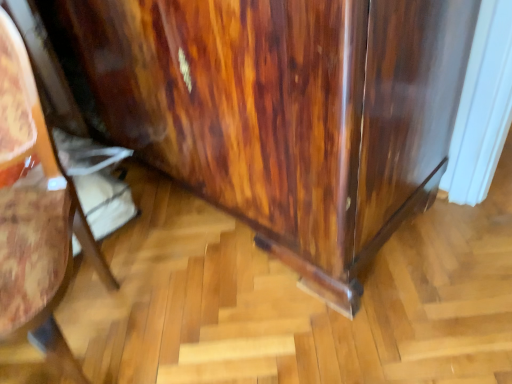
Find the location of a particular element. This screenshot has width=512, height=384. glossy wood cabinet at lower right is located at coordinates (35, 214).

This screenshot has width=512, height=384. Describe the element at coordinates (35, 214) in the screenshot. I see `glossy wood cabinet at lower right` at that location.

In order to face glossy wood cabinet at lower right, should I rotate leftwards or rightwards?

You should rotate left by 33.629 degrees.

In order to face glossy wood dresser at lower right, should I rotate leftwards or rightwards?

It's best to rotate left around 8.613 degrees.

This screenshot has width=512, height=384. What are the coordinates of `glossy wood dresser at lower right` in the screenshot? It's located at (281, 111).

What do you see at coordinates (281, 111) in the screenshot?
I see `glossy wood dresser at lower right` at bounding box center [281, 111].

What are the coordinates of `glossy wood cabinet at lower right` in the screenshot? It's located at (35, 214).

In the scene shown: Considering the relative positions of glossy wood dresser at lower right and glossy wood cabinet at lower right in the image provided, is glossy wood dresser at lower right to the right of glossy wood cabinet at lower right from the viewer's perspective?

Indeed, glossy wood dresser at lower right is positioned on the right side of glossy wood cabinet at lower right.

Is glossy wood dresser at lower right positioned behind glossy wood cabinet at lower right?

Yes, glossy wood dresser at lower right is further from the camera.

Consider the image. Which is nearer, (304, 158) or (52, 268)?

The point (52, 268) is in front.

Based on the photo, from the image's perspective, is glossy wood dresser at lower right above glossy wood cabinet at lower right?

Yes, from the image's perspective, glossy wood dresser at lower right is on top of glossy wood cabinet at lower right.

From a real-world perspective, which object stands above the other?

glossy wood dresser at lower right is physically above.

Considering the sizes of glossy wood dresser at lower right and glossy wood cabinet at lower right in the image, is glossy wood dresser at lower right wider or thinner than glossy wood cabinet at lower right?

Clearly, glossy wood dresser at lower right has more width compared to glossy wood cabinet at lower right.

Considering the sizes of glossy wood dresser at lower right and glossy wood cabinet at lower right in the image, is glossy wood dresser at lower right taller or shorter than glossy wood cabinet at lower right?

Clearly, glossy wood dresser at lower right is taller compared to glossy wood cabinet at lower right.

Is glossy wood dresser at lower right bigger or smaller than glossy wood cabinet at lower right?

In the image, glossy wood dresser at lower right appears to be larger than glossy wood cabinet at lower right.

Is glossy wood dresser at lower right outside of glossy wood cabinet at lower right?

Indeed, glossy wood dresser at lower right is completely outside glossy wood cabinet at lower right.

Is glossy wood dresser at lower right directly adjacent to glossy wood cabinet at lower right?

There is a gap between glossy wood dresser at lower right and glossy wood cabinet at lower right.

Is glossy wood dresser at lower right aimed at glossy wood cabinet at lower right?

Yes, glossy wood dresser at lower right is turned towards glossy wood cabinet at lower right.

This screenshot has height=384, width=512. What are the coordinates of `dresser that is above the glossy wood cabinet at lower right (from a real-world perspective)` in the screenshot? It's located at [x=281, y=111].

Is glossy wood cabinet at lower right to the right of glossy wood dresser at lower right from the viewer's perspective?

Incorrect, glossy wood cabinet at lower right is not on the right side of glossy wood dresser at lower right.

Which object is further away from the camera, glossy wood cabinet at lower right or glossy wood dresser at lower right?

glossy wood dresser at lower right is more distant.

Which point is more forward, (58, 183) or (231, 160)?

Point (58, 183)

From the image's perspective, relative to glossy wood dresser at lower right, is glossy wood cabinet at lower right above or below?

Clearly, from the image's perspective, glossy wood cabinet at lower right is below glossy wood dresser at lower right.

From a real-world perspective, is glossy wood cabinet at lower right positioned over glossy wood dresser at lower right based on gravity?

No.

Considering the relative sizes of glossy wood cabinet at lower right and glossy wood dresser at lower right in the image provided, is glossy wood cabinet at lower right thinner than glossy wood dresser at lower right?

Yes.

Can you confirm if glossy wood cabinet at lower right is taller than glossy wood dresser at lower right?

No, glossy wood cabinet at lower right is not taller than glossy wood dresser at lower right.

Looking at the image, does glossy wood cabinet at lower right seem bigger or smaller compared to glossy wood dresser at lower right?

glossy wood cabinet at lower right is smaller than glossy wood dresser at lower right.

Would you say glossy wood cabinet at lower right contains glossy wood dresser at lower right?

Definitely not — glossy wood dresser at lower right is not inside glossy wood cabinet at lower right.

Is the surface of glossy wood cabinet at lower right in direct contact with glossy wood dresser at lower right?

glossy wood cabinet at lower right and glossy wood dresser at lower right are not in contact.

Is glossy wood cabinet at lower right oriented away from glossy wood dresser at lower right?

Correct, glossy wood cabinet at lower right is looking away from glossy wood dresser at lower right.

In order to click on furniture located in front of the glossy wood dresser at lower right in this screenshot , I will do (x=35, y=214).

Where is `dresser behind the glossy wood cabinet at lower right`? The height and width of the screenshot is (384, 512). dresser behind the glossy wood cabinet at lower right is located at coordinates (281, 111).

Find the location of a particular element. The image size is (512, 384). dresser on the right of glossy wood cabinet at lower right is located at coordinates (281, 111).